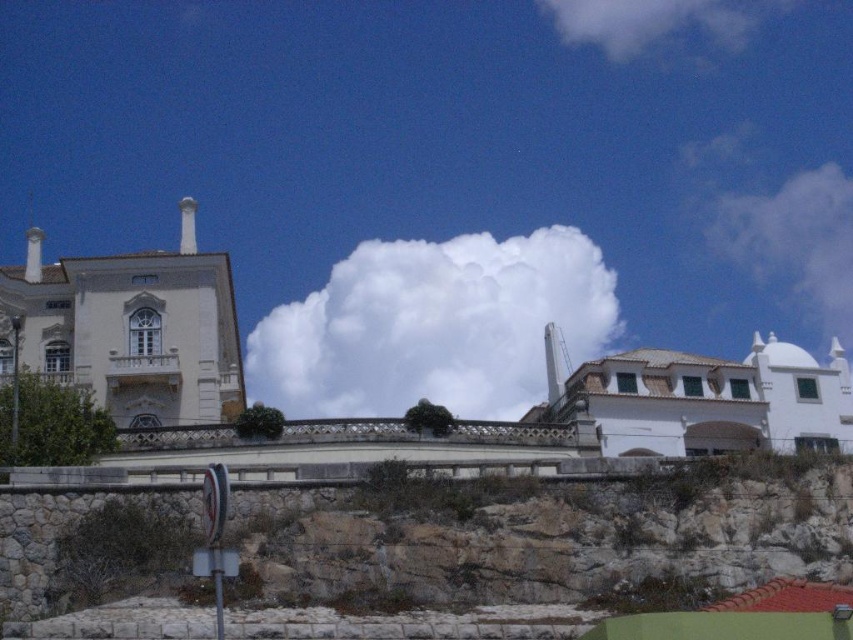
You are standing at the base of the rocky cliff at lower center and want to look up at the white fluffy cloud at upper center. Can you see the cloud without any obstruction?

The rocky cliff at lower center is not as tall as the white fluffy cloud at upper center, so yes, you can see the white fluffy cloud at upper center without obstruction.

You are standing in front of the beige building and looking towards the white building. You notice two white fluffy clouds in the sky. Which cloud is closer to you, the white fluffy cloud at center or the white fluffy cloud at upper right?

The white fluffy cloud at center is closer to the viewer than the white fluffy cloud at upper right.